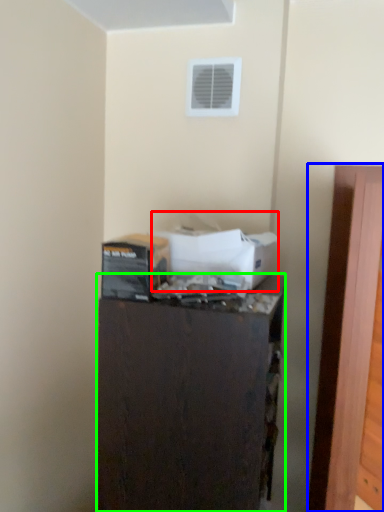
Question: Which object is positioned closest to box (highlighted by a red box)? Select from door (highlighted by a blue box) and furniture (highlighted by a green box).

Choices:
 (A) door
 (B) furniture

Answer: (B)